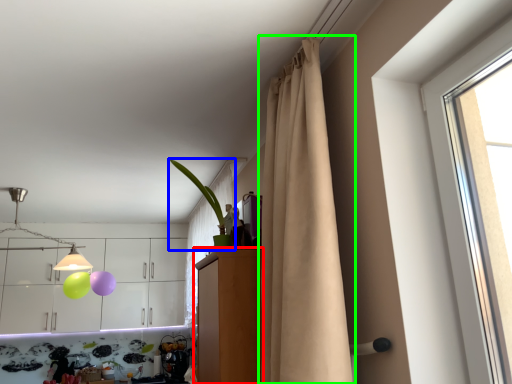
Question: Which is nearer to the dresser (highlighted by a red box)? houseplant (highlighted by a blue box) or curtain (highlighted by a green box).

Choices:
 (A) houseplant
 (B) curtain

Answer: (A)